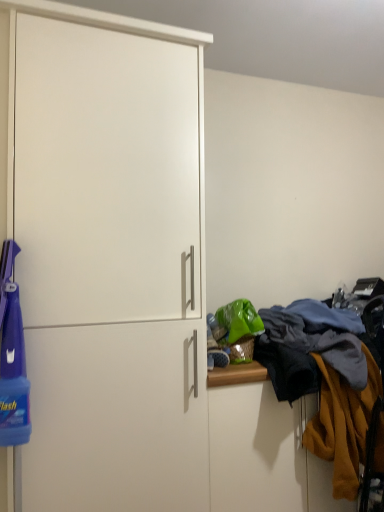
Question: Is white matte cabinet at left facing towards mustard yellow fabric at right?

Choices:
 (A) yes
 (B) no

Answer: (B)

Question: Is white matte cabinet at left surrounding mustard yellow fabric at right?

Choices:
 (A) yes
 (B) no

Answer: (B)

Question: Does white matte cabinet at left lie in front of mustard yellow fabric at right?

Choices:
 (A) yes
 (B) no

Answer: (A)

Question: From the image's perspective, is white matte cabinet at left below mustard yellow fabric at right?

Choices:
 (A) no
 (B) yes

Answer: (A)

Question: Does white matte cabinet at left have a greater height compared to mustard yellow fabric at right?

Choices:
 (A) no
 (B) yes

Answer: (B)

Question: Considering the relative sizes of white matte cabinet at left and mustard yellow fabric at right in the image provided, is white matte cabinet at left wider than mustard yellow fabric at right?

Choices:
 (A) no
 (B) yes

Answer: (B)

Question: From a real-world perspective, is mustard yellow fabric at right below white matte cabinet at left?

Choices:
 (A) yes
 (B) no

Answer: (A)

Question: Is mustard yellow fabric at right positioned behind white matte cabinet at left?

Choices:
 (A) no
 (B) yes

Answer: (B)

Question: Is mustard yellow fabric at right directly adjacent to white matte cabinet at left?

Choices:
 (A) yes
 (B) no

Answer: (B)

Question: Does mustard yellow fabric at right have a greater width compared to white matte cabinet at left?

Choices:
 (A) yes
 (B) no

Answer: (B)

Question: Considering the relative sizes of mustard yellow fabric at right and white matte cabinet at left in the image provided, is mustard yellow fabric at right shorter than white matte cabinet at left?

Choices:
 (A) no
 (B) yes

Answer: (B)

Question: From a real-world perspective, is mustard yellow fabric at right on white matte cabinet at left?

Choices:
 (A) yes
 (B) no

Answer: (B)

Question: From the image's perspective, is textured woolen sweater at right located beneath mustard yellow fabric at right?

Choices:
 (A) no
 (B) yes

Answer: (A)